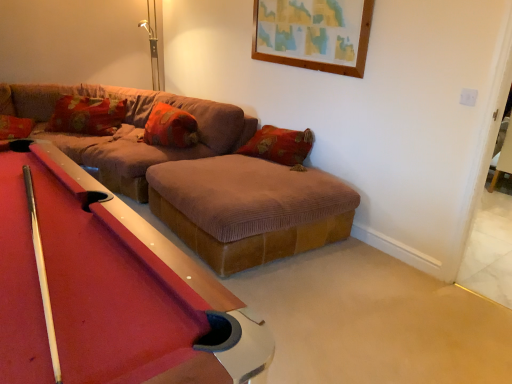
Question: Is brown corduroy couch at center positioned far away from brown corduroy footrest at center?

Choices:
 (A) no
 (B) yes

Answer: (A)

Question: Considering the relative sizes of brown corduroy couch at center and brown corduroy footrest at center in the image provided, is brown corduroy couch at center thinner than brown corduroy footrest at center?

Choices:
 (A) no
 (B) yes

Answer: (A)

Question: From the image's perspective, is brown corduroy couch at center located above brown corduroy footrest at center?

Choices:
 (A) yes
 (B) no

Answer: (A)

Question: Could you tell me if brown corduroy couch at center is facing brown corduroy footrest at center?

Choices:
 (A) yes
 (B) no

Answer: (A)

Question: From the image's perspective, is brown corduroy couch at center located beneath brown corduroy footrest at center?

Choices:
 (A) no
 (B) yes

Answer: (A)

Question: Can you see brown corduroy couch at center touching brown corduroy footrest at center?

Choices:
 (A) no
 (B) yes

Answer: (A)

Question: Is rubberized felt pool table at center not inside velvet orange pillow at center, acting as the first pillow starting from the right?

Choices:
 (A) no
 (B) yes

Answer: (B)

Question: Is rubberized felt pool table at center bigger than velvet orange pillow at center, marked as the second pillow in a left-to-right arrangement?

Choices:
 (A) yes
 (B) no

Answer: (A)

Question: From the image's perspective, is rubberized felt pool table at center under velvet orange pillow at center, marked as the second pillow in a left-to-right arrangement?

Choices:
 (A) no
 (B) yes

Answer: (B)

Question: Does rubberized felt pool table at center have a greater width compared to velvet orange pillow at center, marked as the second pillow in a left-to-right arrangement?

Choices:
 (A) no
 (B) yes

Answer: (B)

Question: From a real-world perspective, is rubberized felt pool table at center over velvet orange pillow at center, marked as the second pillow in a left-to-right arrangement?

Choices:
 (A) yes
 (B) no

Answer: (B)

Question: Does rubberized felt pool table at center have a lesser height compared to velvet orange pillow at center, marked as the second pillow in a left-to-right arrangement?

Choices:
 (A) no
 (B) yes

Answer: (A)

Question: From a real-world perspective, does brown corduroy couch at center stand above velvet orange pillow at center, acting as the first pillow starting from the right?

Choices:
 (A) yes
 (B) no

Answer: (B)